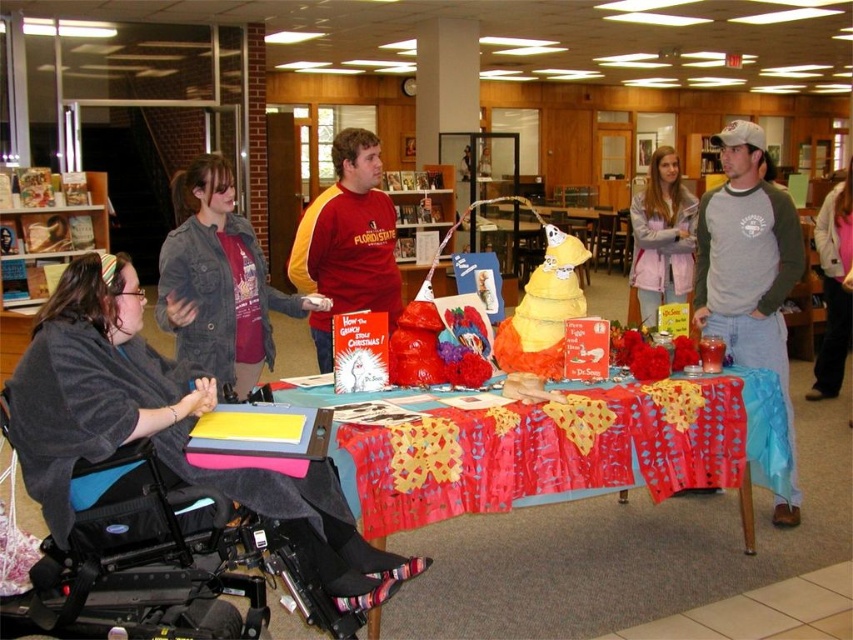
Question: Does red matte shirt at center appear on the right side of gray fleece jacket at upper center?

Choices:
 (A) yes
 (B) no

Answer: (B)

Question: Is pastel pink hoodie at upper right positioned behind cardboard box at center?

Choices:
 (A) yes
 (B) no

Answer: (B)

Question: Which object is the closest to the pastel pink hoodie at upper right?

Choices:
 (A) black fabric wheelchair at lower left
 (B) gray-green long-sleeve shirt at upper right
 (C) wooden bookshelf at lower left

Answer: (B)

Question: Is red fabric tablecloth at center wider than black fabric wheelchair at lower left?

Choices:
 (A) yes
 (B) no

Answer: (A)

Question: Which point is farther to the camera?

Choices:
 (A) wooden bookshelf at lower left
 (B) gray fleece jacket at upper center

Answer: (A)

Question: Which point is farther from the camera taking this photo?

Choices:
 (A) click(396, 182)
 (B) click(62, 244)
 (C) click(497, 454)
 (D) click(183, 237)

Answer: (A)